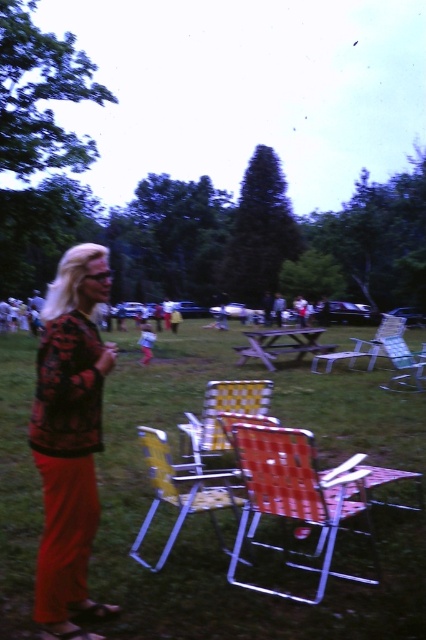
You are standing in the park and want to place a small flag exactly halfway between point (120, 368) and point (143, 355). Which point is closer to the flag once it is placed?

Point (120, 368) is closer to the flag because it is closer to the viewer than point (143, 355).

You are planning to set up a small outdoor event and need to decide between the yellow woven fabric beach chair at center and the yellow fabric chair at center. Based on the space they occupy, which chair would allow you to fit more chairs in the same area?

The yellow woven fabric beach chair at center occupies less space than the yellow fabric chair at center, so choosing it would allow you to fit more chairs in the same area.

Looking at this image, you are standing at the center of the park and want to place a new bench exactly 2 meters to the right of the yellow woven fabric beach chair at center. Given the park layout, is there enough space to place the bench without it overlapping any existing objects?

The yellow woven fabric beach chair at center is located at point (218, 419). However, the park layout details beyond this coordinate are not provided, so it is impossible to determine if placing a bench 2 meters to the right would overlap existing objects.